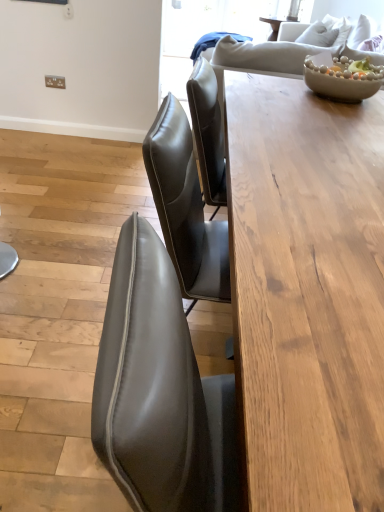
Question: In terms of height, does wooden table at center look taller or shorter compared to matte beige bowl at upper right?

Choices:
 (A) tall
 (B) short

Answer: (A)

Question: From the image's perspective, is wooden table at center positioned above or below matte beige bowl at upper right?

Choices:
 (A) above
 (B) below

Answer: (B)

Question: Considering the positions of wooden table at center and matte beige bowl at upper right in the image, is wooden table at center wider or thinner than matte beige bowl at upper right?

Choices:
 (A) wide
 (B) thin

Answer: (A)

Question: Considering the positions of point pyautogui.click(x=311, y=62) and point pyautogui.click(x=258, y=169), is point pyautogui.click(x=311, y=62) closer or farther from the camera than point pyautogui.click(x=258, y=169)?

Choices:
 (A) closer
 (B) farther

Answer: (B)

Question: Is matte beige bowl at upper right spatially inside wooden table at center, or outside of it?

Choices:
 (A) inside
 (B) outside

Answer: (B)

Question: Is matte beige bowl at upper right bigger or smaller than wooden table at center?

Choices:
 (A) small
 (B) big

Answer: (A)

Question: From a real-world perspective, relative to wooden table at center, is matte beige bowl at upper right vertically above or below?

Choices:
 (A) above
 (B) below

Answer: (A)